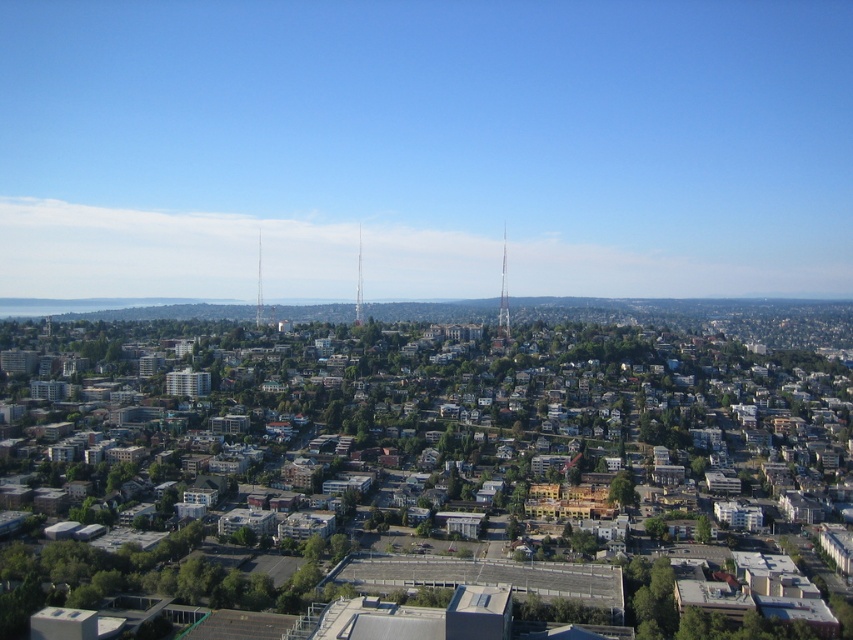
You are a city planner evaluating the spacing between two communication towers in the urban area. The city requires at least 100 meters between such towers for safety. Are the smooth glass tower at center and metallic silver tower at center compliant with this regulation?

The smooth glass tower at center and metallic silver tower at center are 106.36 meters apart, which exceeds the required 100 meters, so they are compliant with the safety regulation.

You are a drone operator tasked with flying a drone between two towers in the city. You have a metallic silver tower at center and a silver metallic tower at center in your view. Which tower should you fly the drone above to ensure it reaches the higher elevation?

The metallic silver tower at center has a greater height compared to the silver metallic tower at center, so you should fly the drone above the metallic silver tower at center to reach the higher elevation.

You are a drone operator who needs to fly your drone from your current position to the metallic silver tower at center. Given that your drone has a maximum flight range of 2000 feet, can you reach the tower without needing to recharge?

The metallic silver tower at center is 2012.67 feet away from the viewer. Since the drone can only fly up to 2000 feet before needing a recharge, it cannot reach the tower without recharging.